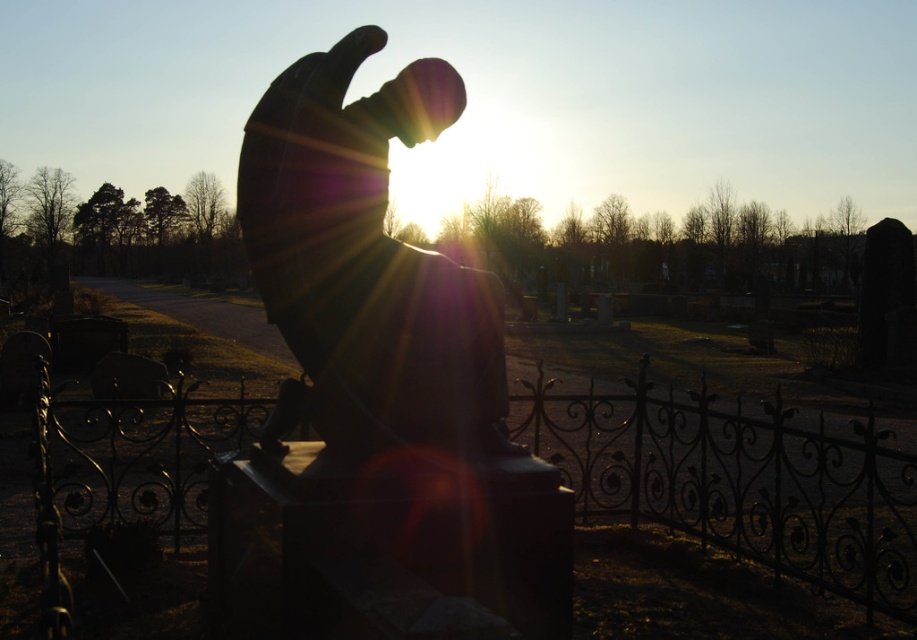
You are visiting a cemetery and want to take a photo of the sculpted stone figure at center without the black wrought iron fence at center appearing in the shot. Is this possible given their positions?

The black wrought iron fence at center is behind the sculpted stone figure at center, so you can take a photo of the sculpted stone figure at center without the fence appearing in the shot by positioning yourself in front of the figure where the fence is out of frame.

You are standing at the entrance of the cemetery and want to take a photo of the sculpted stone figure at center. If your camera has a minimum focusing distance of 5 feet, will you be able to take a clear photo without moving closer?

The sculpted stone figure at center is 7.09 feet away from the camera, which is beyond the minimum focusing distance of 5 feet. Therefore, you can take a clear photo without moving closer.

You are visiting a cemetery and notice the sculpted stone figure at center and the black wrought iron fence at center. Which object is closer to the left side of the image?

The sculpted stone figure at center is positioned on the left side of black wrought iron fence at center, so it is closer to the left side of the image.